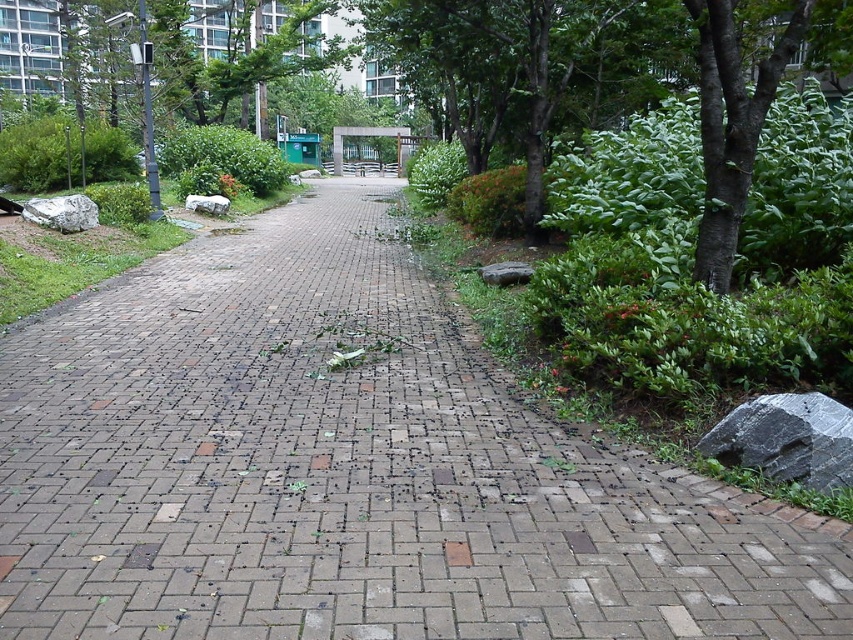
You are standing at the green plastic bus stop at center and need to reach the gray polished rock at lower right. The path between them is 1.2 meters wide. If you walk directly towards the rock, will you be able to fit through the path without going into the greenery on either side?

The path between the gray polished rock at lower right and the green plastic bus stop at center is 1.2 meters wide. Since you are a person with an average shoulder width of about 50 cm, you can comfortably walk through the path without needing to go into the greenery on either side.

You are standing on the paved pathway in the park and see the brick at center and the gray polished rock at lower right. Which object is closer to you?

The brick at center is closer to you because it is in front of the gray polished rock at lower right.